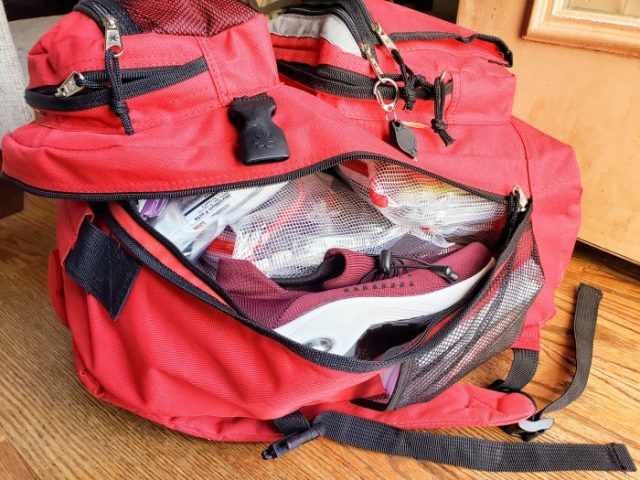
Find the location of a particular element. Image resolution: width=640 pixels, height=480 pixels. frame is located at coordinates (572, 45).